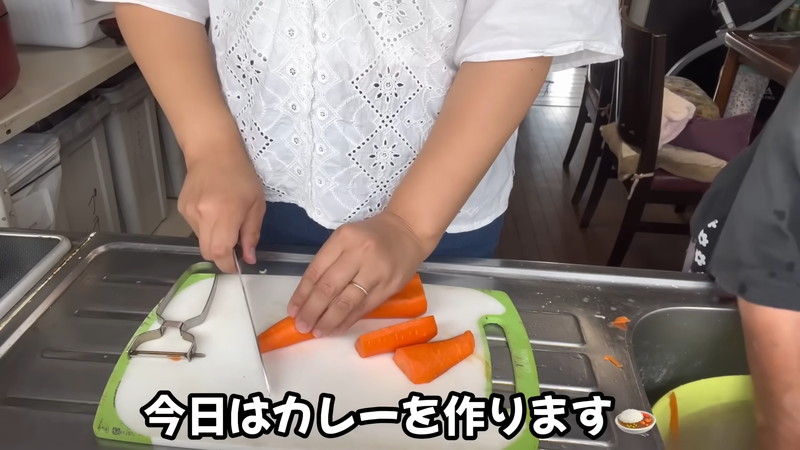
I want to click on floor, so click(549, 207).